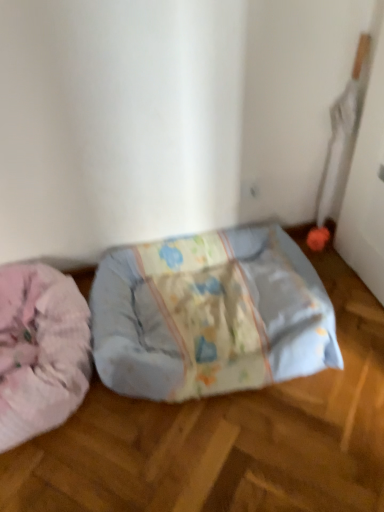
The height and width of the screenshot is (512, 384). What do you see at coordinates (210, 316) in the screenshot? I see `light blue fabric pet bed at center` at bounding box center [210, 316].

Find the location of a particular element. The width and height of the screenshot is (384, 512). light blue fabric pet bed at center is located at coordinates (210, 316).

Where is `fluffy pink dog bed at left`? This screenshot has height=512, width=384. fluffy pink dog bed at left is located at coordinates (40, 351).

Describe the element at coordinates (40, 351) in the screenshot. The width and height of the screenshot is (384, 512). I see `fluffy pink dog bed at left` at that location.

Locate an element on the screen. light blue fabric pet bed at center is located at coordinates (210, 316).

Is fluffy pink dog bed at left to the left or to the right of light blue fabric pet bed at center in the image?

From the image, it's evident that fluffy pink dog bed at left is to the left of light blue fabric pet bed at center.

Is fluffy pink dog bed at left closer to camera compared to light blue fabric pet bed at center?

Yes, it is.

Does point (19, 309) come in front of point (210, 266)?

Yes, it is in front of point (210, 266).

From the image's perspective, is fluffy pink dog bed at left above light blue fabric pet bed at center?

No.

From a real-world perspective, who is located higher, fluffy pink dog bed at left or light blue fabric pet bed at center?

fluffy pink dog bed at left.

Considering the relative sizes of fluffy pink dog bed at left and light blue fabric pet bed at center in the image provided, is fluffy pink dog bed at left wider than light blue fabric pet bed at center?

Indeed, fluffy pink dog bed at left has a greater width compared to light blue fabric pet bed at center.

Considering the sizes of fluffy pink dog bed at left and light blue fabric pet bed at center in the image, is fluffy pink dog bed at left taller or shorter than light blue fabric pet bed at center?

Considering their sizes, fluffy pink dog bed at left has less height than light blue fabric pet bed at center.

Is fluffy pink dog bed at left bigger or smaller than light blue fabric pet bed at center?

Considering their sizes, fluffy pink dog bed at left takes up less space than light blue fabric pet bed at center.

Is light blue fabric pet bed at center inside fluffy pink dog bed at left?

Actually, light blue fabric pet bed at center is outside fluffy pink dog bed at left.

Is fluffy pink dog bed at left next to light blue fabric pet bed at center?

fluffy pink dog bed at left and light blue fabric pet bed at center are not in contact.

Based on the photo, is fluffy pink dog bed at left oriented towards light blue fabric pet bed at center?

No, fluffy pink dog bed at left is not oriented towards light blue fabric pet bed at center.

Can you tell me how much fluffy pink dog bed at left and light blue fabric pet bed at center differ in facing direction?

The facing directions of fluffy pink dog bed at left and light blue fabric pet bed at center are 0.00032 degrees apart.

Find the location of a particular element. The image size is (384, 512). furniture behind the fluffy pink dog bed at left is located at coordinates (210, 316).

Considering the positions of objects light blue fabric pet bed at center and fluffy pink dog bed at left in the image provided, who is more to the left, light blue fabric pet bed at center or fluffy pink dog bed at left?

fluffy pink dog bed at left.

Which object is more forward, light blue fabric pet bed at center or fluffy pink dog bed at left?

Positioned in front is fluffy pink dog bed at left.

Is point (160, 364) positioned before point (4, 316)?

Yes, it is.

From the image's perspective, between light blue fabric pet bed at center and fluffy pink dog bed at left, who is located below?

fluffy pink dog bed at left is shown below in the image.

From a real-world perspective, is light blue fabric pet bed at center over fluffy pink dog bed at left?

No.

Between light blue fabric pet bed at center and fluffy pink dog bed at left, which one has smaller width?

light blue fabric pet bed at center.

Who is shorter, light blue fabric pet bed at center or fluffy pink dog bed at left?

fluffy pink dog bed at left is shorter.

Based on their sizes in the image, would you say light blue fabric pet bed at center is bigger or smaller than fluffy pink dog bed at left?

In the image, light blue fabric pet bed at center appears to be larger than fluffy pink dog bed at left.

Can fluffy pink dog bed at left be found inside light blue fabric pet bed at center?

Definitely not — fluffy pink dog bed at left is not inside light blue fabric pet bed at center.

Is there a large distance between light blue fabric pet bed at center and fluffy pink dog bed at left?

No, light blue fabric pet bed at center is not far away from fluffy pink dog bed at left.

Is light blue fabric pet bed at center looking in the opposite direction of fluffy pink dog bed at left?

light blue fabric pet bed at center is not turned away from fluffy pink dog bed at left.

What's the angular difference between light blue fabric pet bed at center and fluffy pink dog bed at left's facing directions?

There is a 0.00032-degree angle between the facing directions of light blue fabric pet bed at center and fluffy pink dog bed at left.

Where is `dog bed below the light blue fabric pet bed at center (from the image's perspective)`? This screenshot has height=512, width=384. dog bed below the light blue fabric pet bed at center (from the image's perspective) is located at coordinates (40, 351).

The width and height of the screenshot is (384, 512). I want to click on dog bed above the light blue fabric pet bed at center (from a real-world perspective), so click(x=40, y=351).

In the image, there is a light blue fabric pet bed at center. What are the coordinates of `dog bed below it (from the image's perspective)` in the screenshot? It's located at (40, 351).